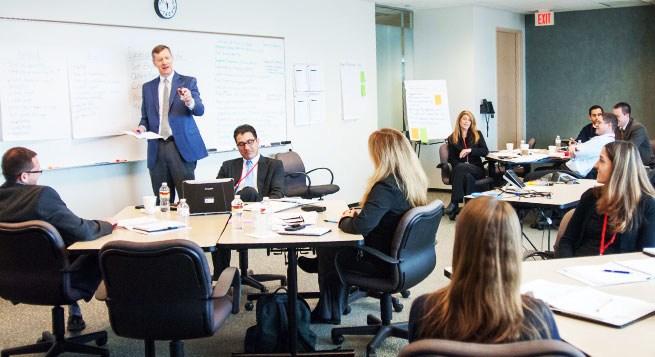
Where is `chairs`? chairs is located at coordinates (188, 311), (52, 290), (383, 276), (302, 174), (443, 164), (565, 223), (538, 341).